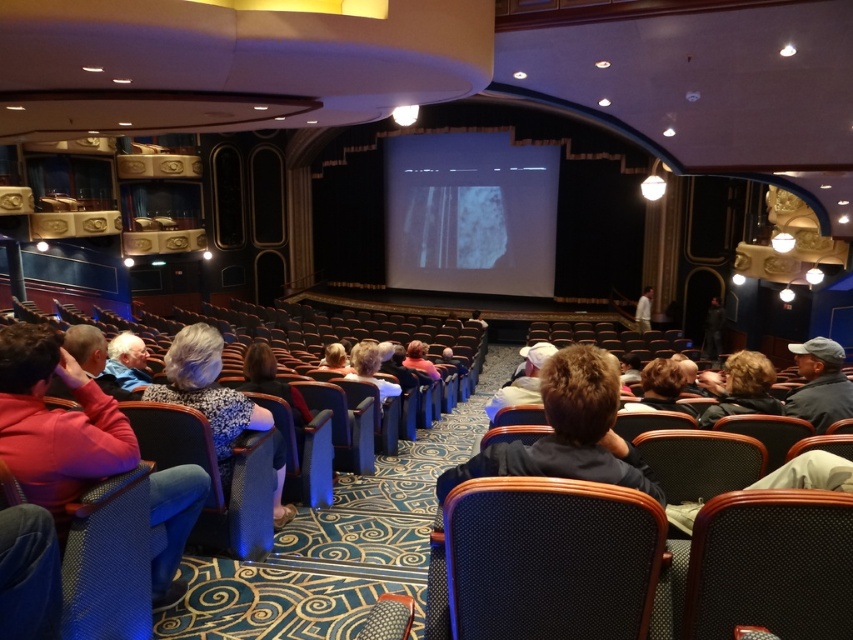
Question: Which of the following is the closest to the observer?

Choices:
 (A) matte blue jacket at left
 (B) floral-patterned sweater at center

Answer: (A)

Question: Which object is positioned farthest from the white fabric hat at center?

Choices:
 (A) textured black fabric chair at center
 (B) brown fabric jacket at center
 (C) floral-patterned sweater at center

Answer: (A)

Question: Is black mesh chair at lower right behind white fabric hat at center?

Choices:
 (A) no
 (B) yes

Answer: (A)

Question: Does floral-patterned sweater at center lie in front of dark brown hair at center?

Choices:
 (A) no
 (B) yes

Answer: (B)

Question: Does textured black fabric chair at center appear over dark brown hair at center?

Choices:
 (A) no
 (B) yes

Answer: (A)

Question: Which point appears closest to the camera in this image?

Choices:
 (A) (396, 388)
 (B) (514, 573)
 (C) (810, 358)

Answer: (B)